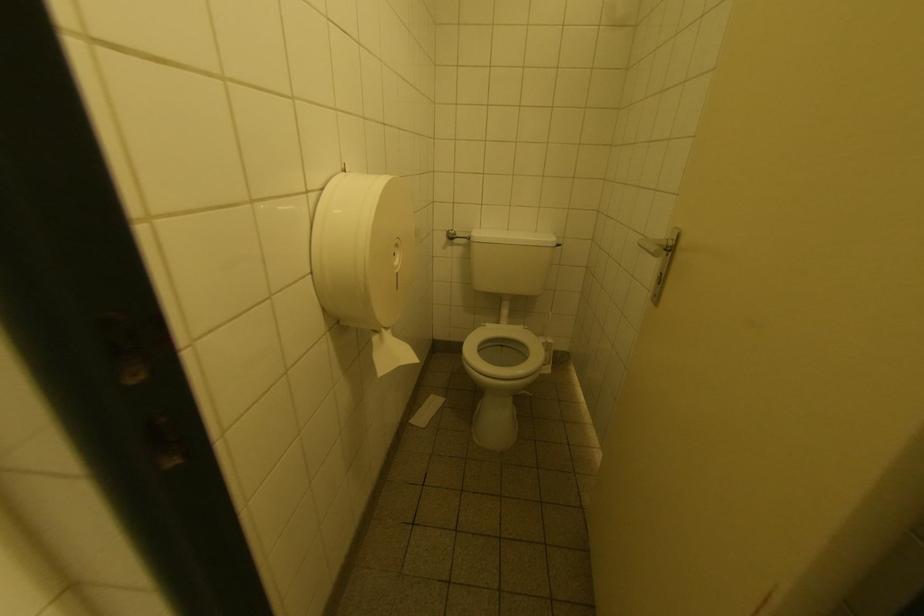
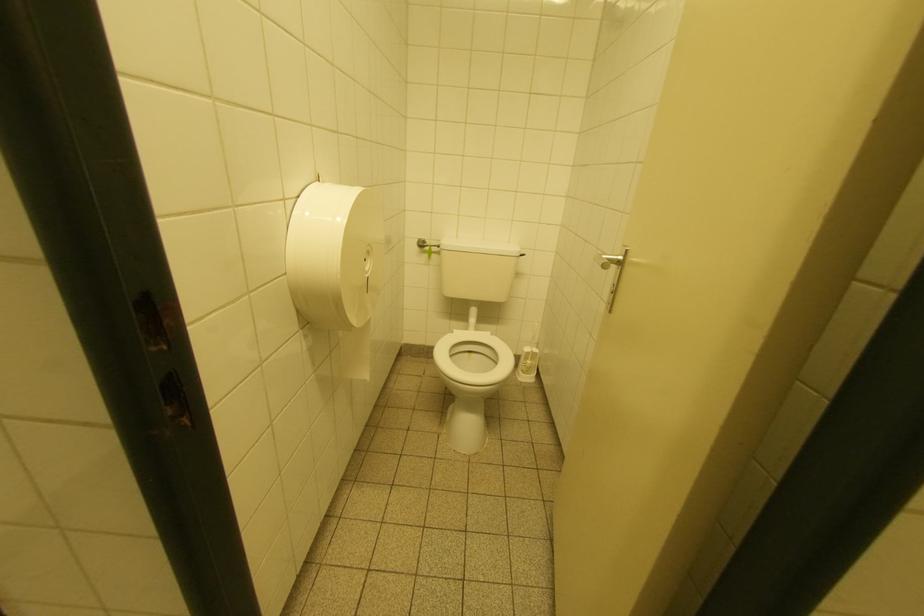
Question: The camera is either moving clockwise (left) or counter-clockwise (right) around the object. The first image is from the beginning of the video and the second image is from the end. Is the camera moving left or right when shooting the video?

Choices:
 (A) Left
 (B) Right

Answer: (A)